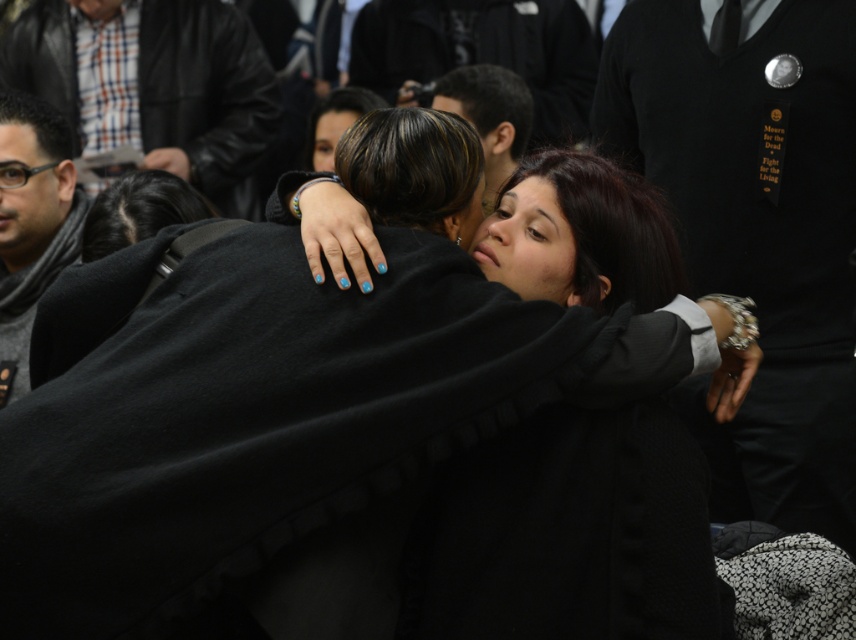
Question: Based on their relative distances, which object is farther from the leather jacket at upper left?

Choices:
 (A) dark brown hair at center
 (B) gray knit scarf at left
 (C) matte black coat at center

Answer: (C)

Question: Does leather jacket at upper left appear over gray knit scarf at left?

Choices:
 (A) no
 (B) yes

Answer: (B)

Question: Which object is the farthest from the leather jacket at upper left?

Choices:
 (A) dark brown hair at center
 (B) matte black coat at center
 (C) gray knit scarf at left

Answer: (B)

Question: Can you confirm if matte black coat at center is wider than dark brown hair at center?

Choices:
 (A) no
 (B) yes

Answer: (B)

Question: Among these points, which one is farthest from the camera?

Choices:
 (A) (236, 38)
 (B) (0, 140)
 (C) (531, 112)
 (D) (281, 544)

Answer: (A)

Question: Is leather jacket at upper left above gray knit scarf at left?

Choices:
 (A) yes
 (B) no

Answer: (A)